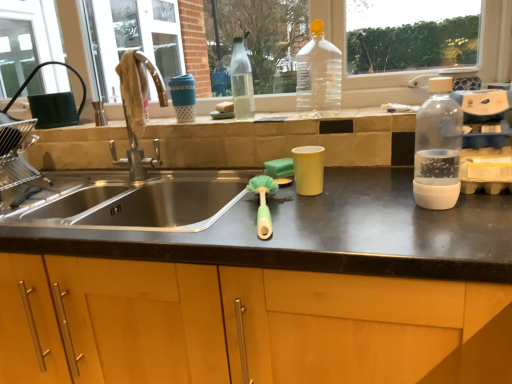
You are a GUI agent. You are given a task and a screenshot of the screen. Output one action in this format:
    pyautogui.click(x=<x>, y=<y>)
    Task: Click on the unoccupied area in front of green rubber brush at center
    The image size is (512, 384).
    Given the screenshot: What is the action you would take?
    pyautogui.click(x=281, y=239)